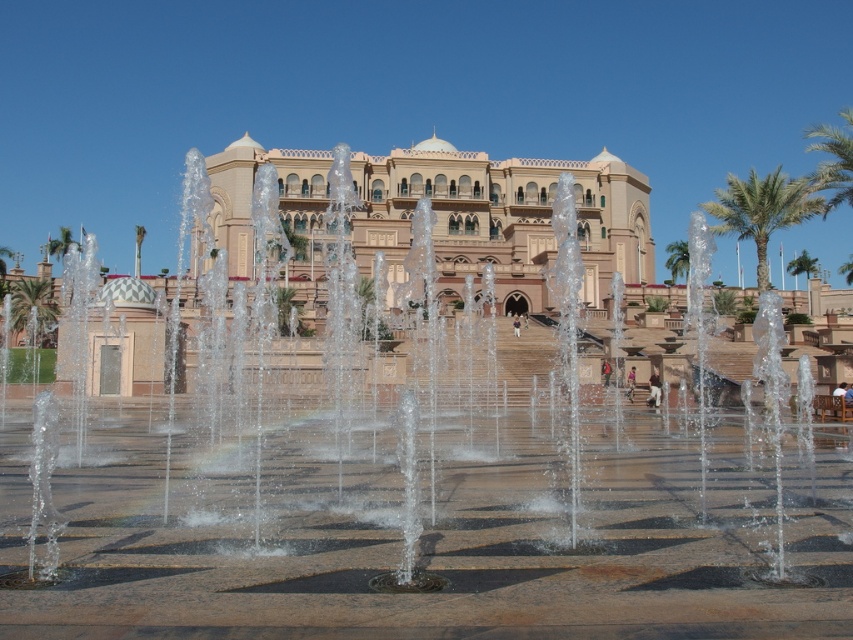
Question: Is green leafy palm tree at upper right thinner than green leafy palm tree at left?

Choices:
 (A) no
 (B) yes

Answer: (A)

Question: Which point is farther to the camera?

Choices:
 (A) pos(834,132)
 (B) pos(24,285)

Answer: (B)

Question: Which of these objects is positioned farthest from the green leafy palm tree at left?

Choices:
 (A) green leafy palm tree at right
 (B) green leafy palm tree at upper right
 (C) beige stone palace at center
 (D) clear water jets at center

Answer: (B)

Question: Is clear water jets at center behind beige stone palace at center?

Choices:
 (A) no
 (B) yes

Answer: (A)

Question: Is green leafy palm tree at right positioned behind green leafy palm tree at upper right?

Choices:
 (A) yes
 (B) no

Answer: (A)

Question: Which object is positioned farthest from the green leafy palm tree at upper right?

Choices:
 (A) clear water jets at center
 (B) green leafy palm tree at right
 (C) green leafy palm tree at left

Answer: (C)